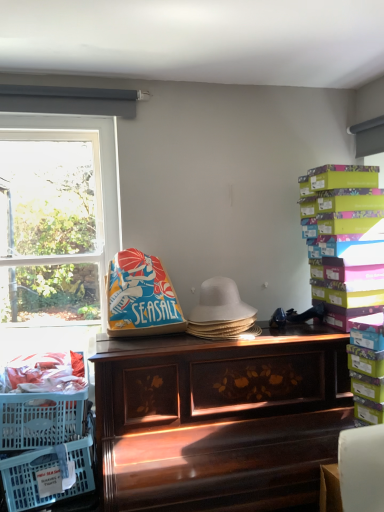
Question: Is wooden piano at center taller or shorter than multicolored cardboard boxes at right?

Choices:
 (A) short
 (B) tall

Answer: (B)

Question: Is wooden piano at center inside or outside of multicolored cardboard boxes at right?

Choices:
 (A) outside
 (B) inside

Answer: (A)

Question: Estimate the real-world distances between objects in this image. Which object is closer to the white plastic window at left?

Choices:
 (A) wooden piano at center
 (B) translucent plastic crate at lower left
 (C) white woven hat at center
 (D) multicolored cardboard boxes at right

Answer: (A)

Question: Which of these objects is positioned farthest from the multicolored cardboard boxes at right?

Choices:
 (A) white woven hat at center
 (B) translucent plastic crate at lower left
 (C) wooden piano at center
 (D) white plastic window at left

Answer: (D)